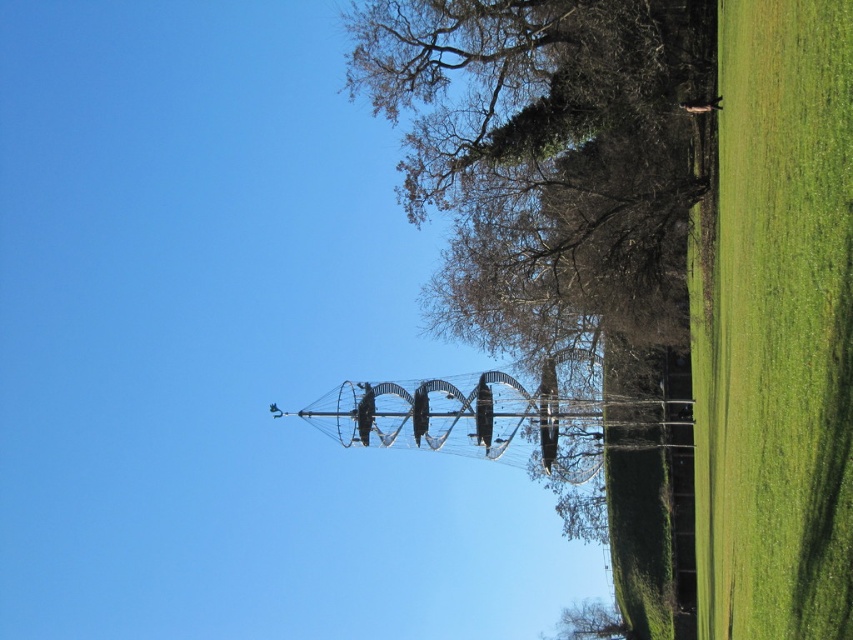
You are standing in the park looking at the spiral staircase sculpture. You notice two points marked on the structure. One is at coordinate point (767,184) and the other at point (607,620). Which of these two points is physically closer to you as you view the sculpture?

Point (767,184) is closer to the viewer than point (607,620).

Based on the photo, you are standing in the park and want to walk from the green grass at right to the green leafy tree at lower center. Which direction should you move to get closer to the tree?

To get closer to the green leafy tree at lower center, you should move toward the lower center direction since the tree is located at lower center relative to the grass at right.

You are an architect planning to install a new sculpture that requires a clear space of 100 feet between the green grass at right and the green leafy tree at lower center. Based on the scene, is the distance sufficient for your project?

The green grass at right is 124.36 feet from the green leafy tree at lower center, which is more than the required 100 feet. Therefore, the distance is sufficient for the sculpture installation.